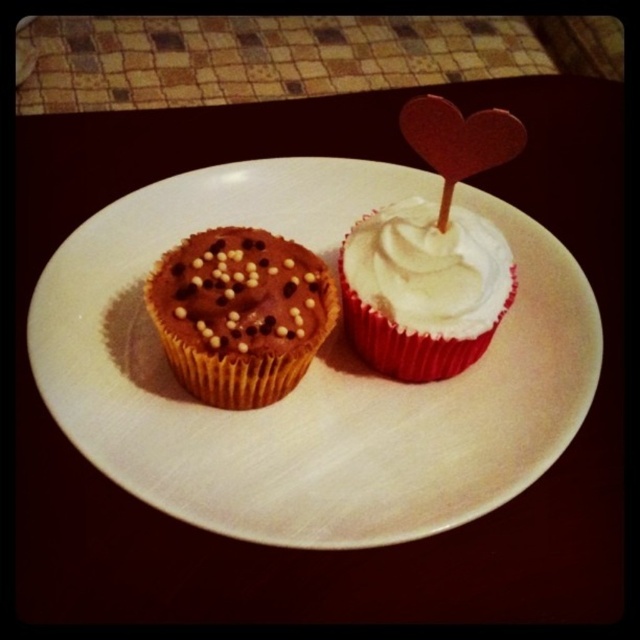
Between matte paper plate at center and chocolate-coated muffin with sprinkles at left, which one is positioned higher?

chocolate-coated muffin with sprinkles at left is higher up.

Locate an element on the screen. The image size is (640, 640). matte paper plate at center is located at coordinates [308, 371].

Locate an element on the screen. The width and height of the screenshot is (640, 640). matte paper plate at center is located at coordinates (308, 371).

In the scene shown: Is chocolate-coated muffin with sprinkles at left shorter than white matte cupcake at center?

Indeed, chocolate-coated muffin with sprinkles at left has a lesser height compared to white matte cupcake at center.

Who is taller, chocolate-coated muffin with sprinkles at left or white matte cupcake at center?

Standing taller between the two is white matte cupcake at center.

Between point (168, 262) and point (397, 305), which one is positioned behind?

The point (168, 262) is behind.

At what (x,y) coordinates should I click in order to perform the action: click on chocolate-coated muffin with sprinkles at left. Please return your answer as a coordinate pair (x, y). Looking at the image, I should click on (241, 314).

Who is more forward, (x=145, y=205) or (x=429, y=227)?

Point (x=429, y=227) is in front.

Can you confirm if matte paper plate at center is positioned above white matte cupcake at center?

No.

Locate an element on the screen. matte paper plate at center is located at coordinates [x=308, y=371].

At what (x,y) coordinates should I click in order to perform the action: click on matte paper plate at center. Please return your answer as a coordinate pair (x, y). Image resolution: width=640 pixels, height=640 pixels. Looking at the image, I should click on (308, 371).